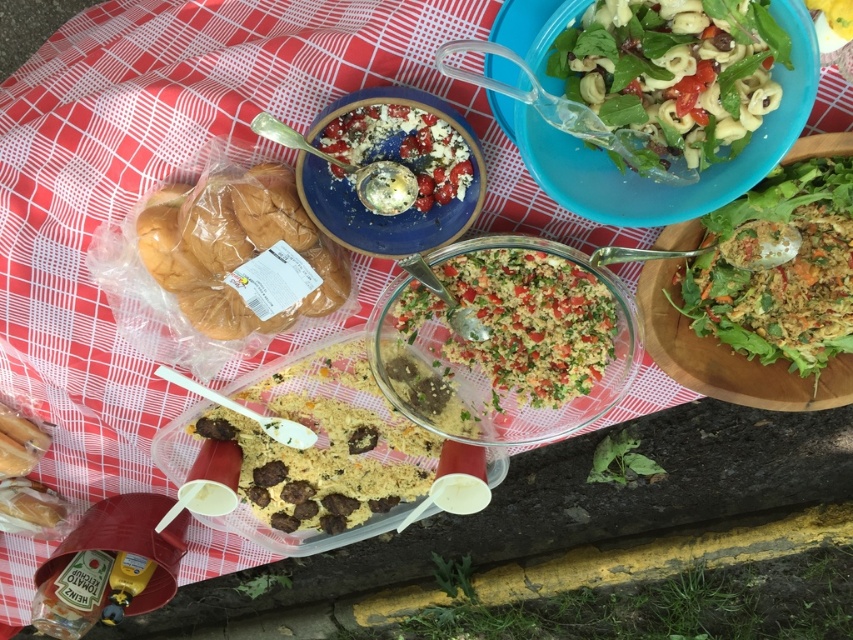
Question: Which object is farther from the camera taking this photo?

Choices:
 (A) matte blue plate with salad at upper center
 (B) golden bread at left
 (C) brown crumbly mix at center
 (D) green crumbly salad at center

Answer: (C)

Question: Can you confirm if brown crumbly mix at center is bigger than green crumbly salad at center?

Choices:
 (A) yes
 (B) no

Answer: (A)

Question: Can you confirm if green crumbly salad at center is positioned above matte blue plate with salad at upper center?

Choices:
 (A) yes
 (B) no

Answer: (B)

Question: Which of the following is the closest to the observer?

Choices:
 (A) (679, 83)
 (B) (287, 381)
 (C) (715, 211)
 (D) (271, 330)

Answer: (A)

Question: Can you confirm if brown crumbly mix at center is positioned to the left of golden bread at left?

Choices:
 (A) no
 (B) yes

Answer: (A)

Question: Which object is the farthest from the matte blue plate with salad at upper center?

Choices:
 (A) crumbly brown bread at right
 (B) brown crumbly mix at center

Answer: (A)